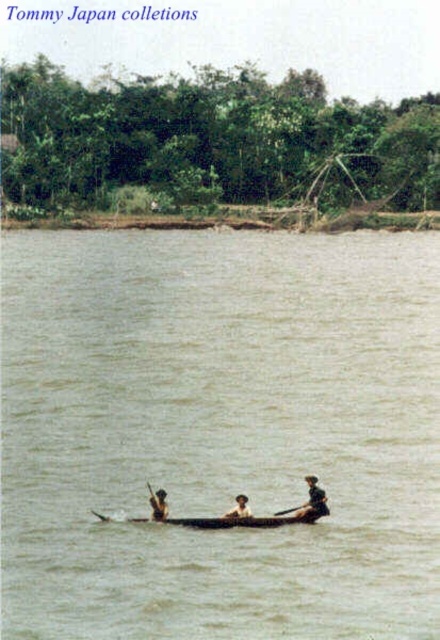
From the picture: Can you confirm if brown wooden boat at center is taller than wooden paddle at center?

Yes.

Is brown wooden boat at center bigger than wooden paddle at center?

Yes, brown wooden boat at center is bigger than wooden paddle at center.

Is point (242, 500) positioned before point (285, 509)?

Yes, point (242, 500) is in front of point (285, 509).

Identify the location of brown wooden boat at center. This screenshot has height=640, width=440. (239, 508).

Between point (217, 570) and point (158, 518), which one is positioned in front?

Point (217, 570) is more forward.

Is brown wooden canoe at center shorter than brown leather boat at center?

In fact, brown wooden canoe at center may be taller than brown leather boat at center.

Who is more forward, (149, 464) or (160, 492)?

Point (160, 492)

At what (x,y) coordinates should I click in order to perform the action: click on brown wooden canoe at center. Please return your answer as a coordinate pair (x, y). Image resolution: width=440 pixels, height=640 pixels. Looking at the image, I should click on (220, 433).

Can you confirm if dark brown wooden paddle at center is taller than brown wooden boat at center?

Correct, dark brown wooden paddle at center is much taller as brown wooden boat at center.

Is dark brown wooden paddle at center shorter than brown wooden boat at center?

No, dark brown wooden paddle at center is not shorter than brown wooden boat at center.

Is point (300, 508) in front of point (248, 513)?

That is False.

Where is `dark brown wooden paddle at center`? dark brown wooden paddle at center is located at coordinates (314, 499).